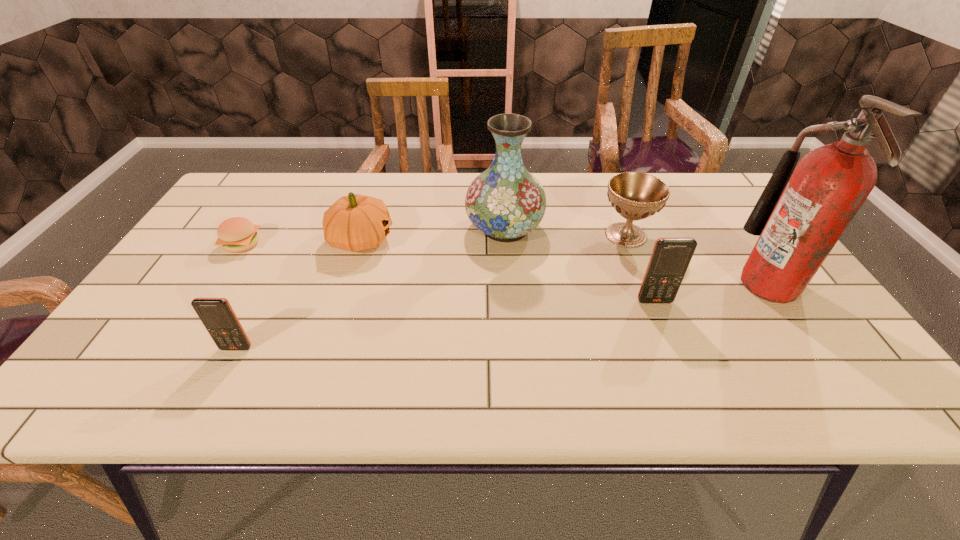
Where is `the tallest object`? The height and width of the screenshot is (540, 960). the tallest object is located at coordinates (799, 217).

Image resolution: width=960 pixels, height=540 pixels. Find the location of `chalice`. chalice is located at coordinates [635, 196].

Find the location of `free space located on the screen of the right cellular telephone`. free space located on the screen of the right cellular telephone is located at coordinates (662, 321).

I want to click on vacant space located 0.250m on the right of the fourth object from right to left, so [x=631, y=228].

Locate an element on the screen. Image resolution: width=960 pixels, height=540 pixels. vacant space located on the front of the leftmost object is located at coordinates (225, 273).

This screenshot has height=540, width=960. I want to click on free space located on the side of the third object from left to right with the carved face, so click(479, 240).

In order to click on vacant space located on the front of the fire extinguisher near the operation label in this screenshot , I will do tap(591, 284).

Locate an element on the screen. free spot located on the front of the fire extinguisher near the operation label is located at coordinates (652, 284).

This screenshot has height=540, width=960. I want to click on free space located 0.300m on the front of the fire extinguisher near the operation label, so click(x=619, y=284).

At what (x,y) coordinates should I click in order to perform the action: click on vacant region located on the back of the chalice. Please return your answer as a coordinate pair (x, y). Image resolution: width=960 pixels, height=540 pixels. Looking at the image, I should click on (611, 197).